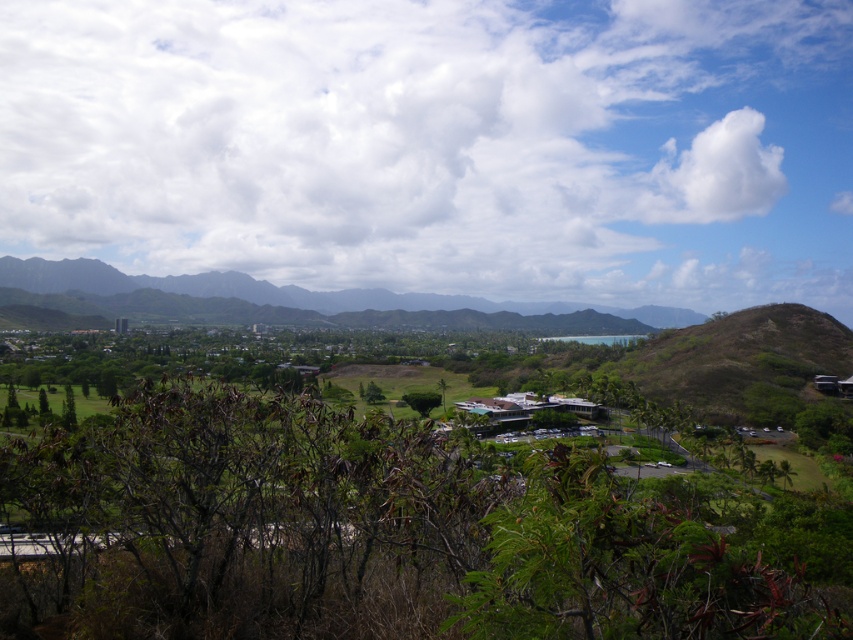
Question: Observing the image, what is the correct spatial positioning of white fluffy cloud at upper center in reference to green leafy shrubs at center?

Choices:
 (A) right
 (B) left

Answer: (B)

Question: Which of the following is the farthest from the observer?

Choices:
 (A) white fluffy cloud at upper center
 (B) green leafy shrubs at center
 (C) white fluffy cloud at upper right

Answer: (C)

Question: Which object is farther from the camera taking this photo?

Choices:
 (A) white fluffy cloud at upper center
 (B) white fluffy cloud at upper right

Answer: (B)

Question: Estimate the real-world distances between objects in this image. Which object is closer to the white fluffy cloud at upper right?

Choices:
 (A) white fluffy cloud at upper center
 (B) green leafy shrubs at center

Answer: (A)

Question: Is green leafy shrubs at center positioned at the back of white fluffy cloud at upper right?

Choices:
 (A) yes
 (B) no

Answer: (B)

Question: Does white fluffy cloud at upper center have a greater width compared to white fluffy cloud at upper right?

Choices:
 (A) yes
 (B) no

Answer: (A)